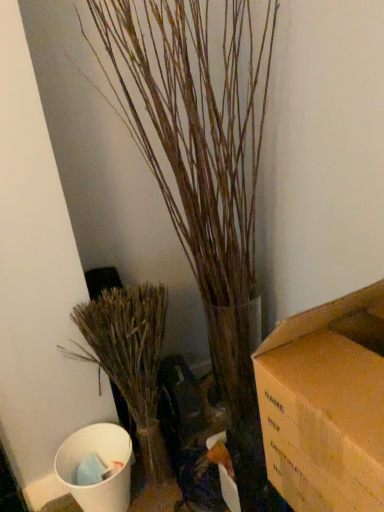
Question: Is bare wood branches at left, which appears as the 2th houseplant when viewed from the top, at the right side of brown textured plant at center, the 2th houseplant positioned from the bottom?

Choices:
 (A) no
 (B) yes

Answer: (A)

Question: Does bare wood branches at left, which appears as the 2th houseplant when viewed from the top, lie in front of brown textured plant at center, the 2th houseplant positioned from the bottom?

Choices:
 (A) no
 (B) yes

Answer: (A)

Question: Is bare wood branches at left, which is the first houseplant in bottom-to-top order, looking in the opposite direction of brown textured plant at center, the 2th houseplant positioned from the bottom?

Choices:
 (A) no
 (B) yes

Answer: (A)

Question: Considering the relative sizes of bare wood branches at left, which appears as the 2th houseplant when viewed from the top, and brown textured plant at center, the 2th houseplant positioned from the bottom, in the image provided, is bare wood branches at left, which appears as the 2th houseplant when viewed from the top, wider than brown textured plant at center, the 2th houseplant positioned from the bottom,?

Choices:
 (A) yes
 (B) no

Answer: (B)

Question: Is bare wood branches at left, which is the first houseplant in bottom-to-top order, thinner than brown textured plant at center, placed as the first houseplant when sorted from top to bottom?

Choices:
 (A) yes
 (B) no

Answer: (A)

Question: Would you consider bare wood branches at left, which is the first houseplant in bottom-to-top order, to be distant from brown textured plant at center, the 2th houseplant positioned from the bottom?

Choices:
 (A) no
 (B) yes

Answer: (A)

Question: From the image's perspective, is brown textured plant at center, placed as the first houseplant when sorted from top to bottom, on bare wood branches at left, which appears as the 2th houseplant when viewed from the top?

Choices:
 (A) yes
 (B) no

Answer: (A)

Question: Can you confirm if brown textured plant at center, placed as the first houseplant when sorted from top to bottom, is positioned to the right of bare wood branches at left, which is the first houseplant in bottom-to-top order?

Choices:
 (A) yes
 (B) no

Answer: (A)

Question: Considering the relative sizes of brown textured plant at center, the 2th houseplant positioned from the bottom, and bare wood branches at left, which is the first houseplant in bottom-to-top order, in the image provided, is brown textured plant at center, the 2th houseplant positioned from the bottom, taller than bare wood branches at left, which is the first houseplant in bottom-to-top order,?

Choices:
 (A) yes
 (B) no

Answer: (A)

Question: Does brown textured plant at center, placed as the first houseplant when sorted from top to bottom, turn towards bare wood branches at left, which appears as the 2th houseplant when viewed from the top?

Choices:
 (A) yes
 (B) no

Answer: (B)

Question: Is brown textured plant at center, placed as the first houseplant when sorted from top to bottom, bigger than bare wood branches at left, which appears as the 2th houseplant when viewed from the top?

Choices:
 (A) no
 (B) yes

Answer: (B)

Question: From a real-world perspective, is brown textured plant at center, the 2th houseplant positioned from the bottom, on top of bare wood branches at left, which appears as the 2th houseplant when viewed from the top?

Choices:
 (A) yes
 (B) no

Answer: (A)

Question: Choose the correct answer: Is brown textured plant at center, placed as the first houseplant when sorted from top to bottom, inside bare wood branches at left, which appears as the 2th houseplant when viewed from the top, or outside it?

Choices:
 (A) outside
 (B) inside

Answer: (A)